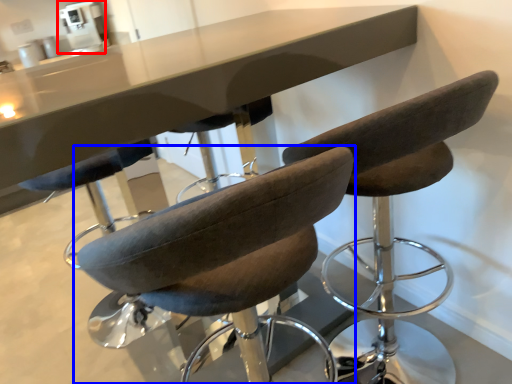
Question: Which of the following is the farthest to the observer, coffee machine (highlighted by a red box) or chair (highlighted by a blue box)?

Choices:
 (A) coffee machine
 (B) chair

Answer: (A)